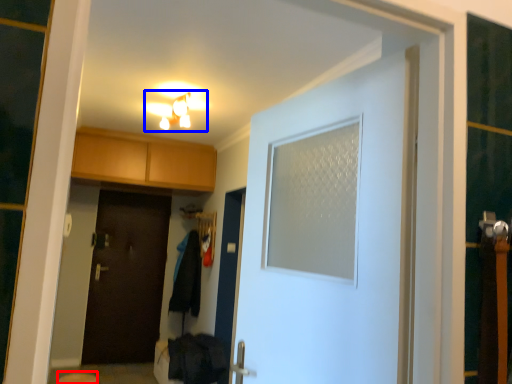
Question: Which of the following is the farthest to the observer, step stool (highlighted by a red box) or light fixture (highlighted by a blue box)?

Choices:
 (A) step stool
 (B) light fixture

Answer: (B)